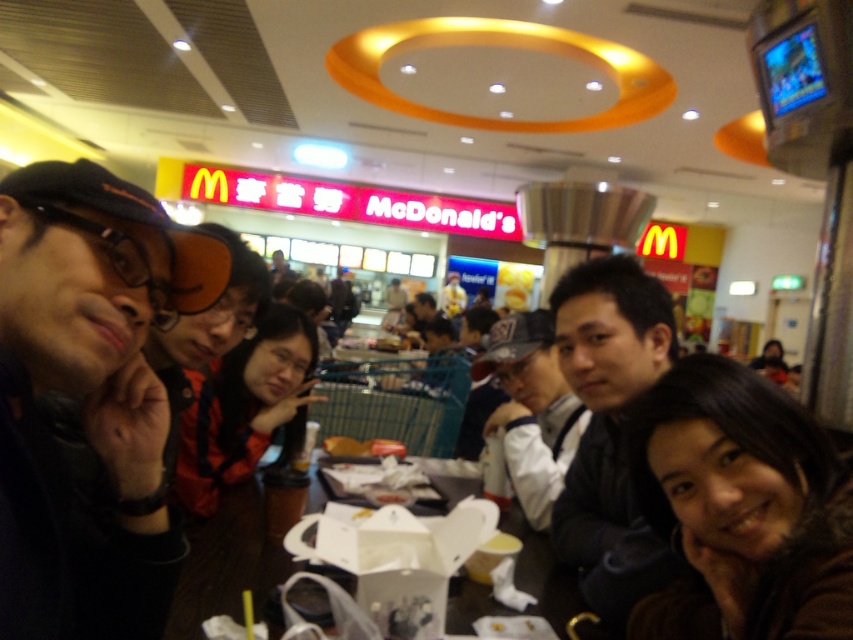
You are a food delivery person who needs to place a hot meal on the wooden table at center without touching the matte black cap at center. Is this possible?

The wooden table at center is located below the matte black cap at center, so placing the meal on the table would not interfere with the cap as long as it is placed away from the cap.

You are a photographer taking a picture of the black matte cap at upper left and the matte black cap at center. Which cap should you focus on first if you want to capture both in the same frame without moving the camera?

You should focus on the black matte cap at upper left first because it is shorter than the matte black cap at center, so it might be closer to the camera and easier to include in the frame.